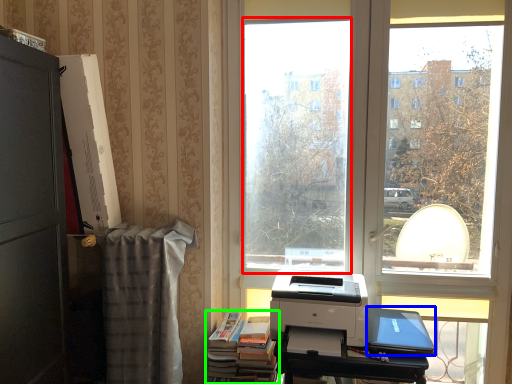
Question: Which is nearer to the window screen (highlighted by a red box)? laptop (highlighted by a blue box) or book (highlighted by a green box).

Choices:
 (A) laptop
 (B) book

Answer: (B)